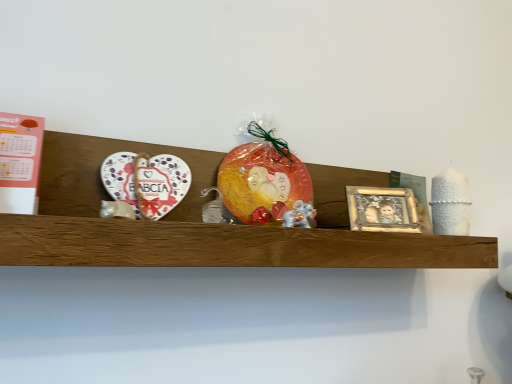
Question: Considering the positions of white ceramic heart at left and gold metallic picture frame at center-right in the image, is white ceramic heart at left taller or shorter than gold metallic picture frame at center-right?

Choices:
 (A) tall
 (B) short

Answer: (B)

Question: In the image, is white ceramic heart at left positioned in front of or behind gold metallic picture frame at center-right?

Choices:
 (A) behind
 (B) front

Answer: (B)

Question: Considering the real-world distances, which object is closest to the white ceramic heart at left?

Choices:
 (A) gold metallic picture frame at center-right
 (B) white glossy mouse at center
 (C) wooden shelf at center
 (D) translucent plastic bag at center

Answer: (D)

Question: Which is nearer to the white glossy mouse at center?

Choices:
 (A) white ceramic heart at left
 (B) gold metallic picture frame at center-right
 (C) translucent plastic bag at center
 (D) wooden shelf at center

Answer: (C)